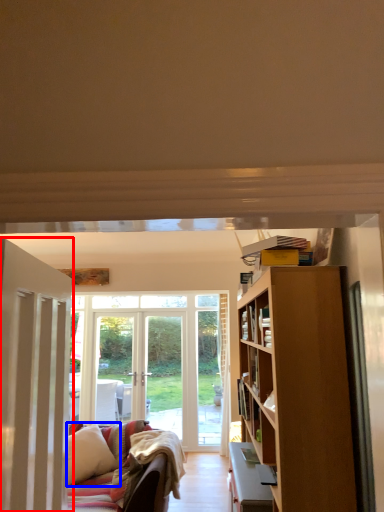
Question: Which object appears farthest to the camera in this image, door (highlighted by a red box) or pillow (highlighted by a blue box)?

Choices:
 (A) door
 (B) pillow

Answer: (B)